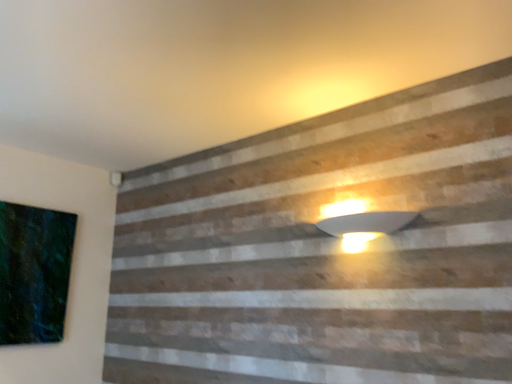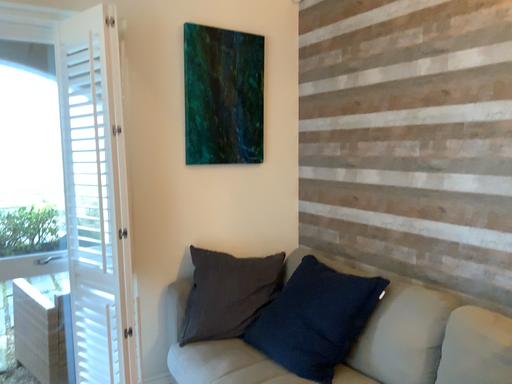
Question: Which way did the camera rotate in the video?

Choices:
 (A) rotated left
 (B) rotated right

Answer: (A)